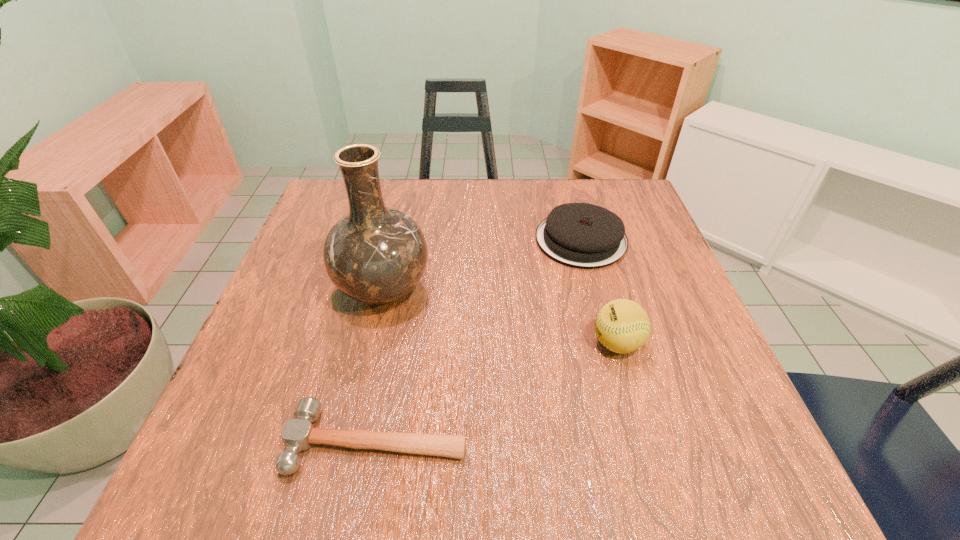
The image size is (960, 540). What are the coordinates of `the tallest object` in the screenshot? It's located at (375, 254).

Locate an element on the screen. the second tallest object is located at coordinates (622, 326).

This screenshot has width=960, height=540. I want to click on pancake, so click(581, 235).

This screenshot has height=540, width=960. What are the coordinates of `the nearest object` in the screenshot? It's located at click(x=298, y=434).

This screenshot has width=960, height=540. I want to click on hammer, so click(298, 434).

The image size is (960, 540). In order to click on blank area located 0.110m on the right of the vase in this screenshot , I will do pyautogui.click(x=483, y=289).

Find the location of `free space located on the logo side of the second tallest object`. free space located on the logo side of the second tallest object is located at coordinates (490, 343).

Where is `free location located on the logo side of the second tallest object`? Image resolution: width=960 pixels, height=540 pixels. free location located on the logo side of the second tallest object is located at coordinates (446, 343).

Find the location of a particular element. The height and width of the screenshot is (540, 960). free spot located 0.210m on the logo side of the second tallest object is located at coordinates (479, 343).

Locate an element on the screen. The image size is (960, 540). free space located on the left of the third tallest object is located at coordinates pyautogui.click(x=481, y=240).